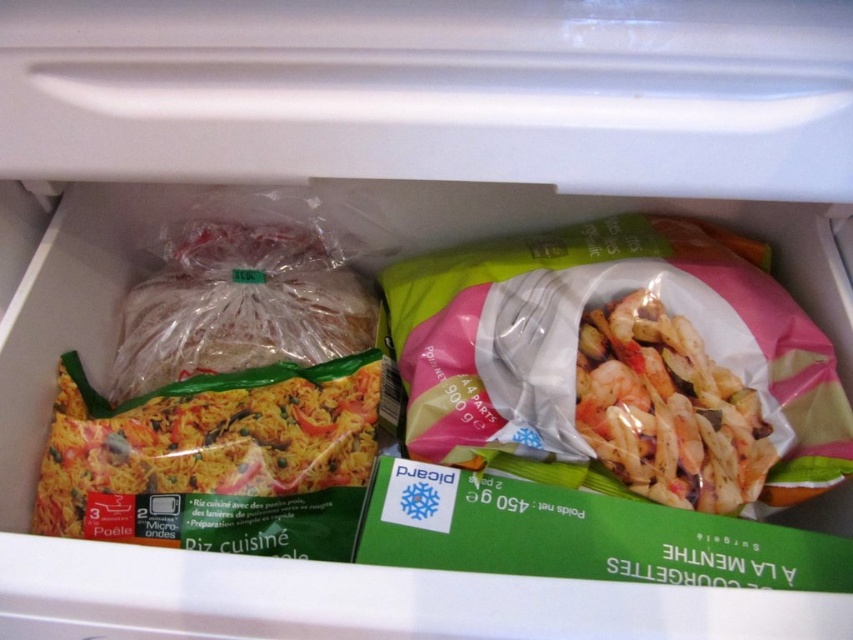
Is green matte rice at center smaller than pink matte shrimp at center?

No, green matte rice at center is not smaller than pink matte shrimp at center.

Between green matte rice at center and pink matte shrimp at center, which one is positioned higher?

pink matte shrimp at center is above.

What are the coordinates of `green matte rice at center` in the screenshot? It's located at (204, 442).

Which is above, pink plastic bag of shrimp at center or pink matte shrimp at center?

Positioned higher is pink plastic bag of shrimp at center.

Which is below, pink plastic bag of shrimp at center or pink matte shrimp at center?

Positioned lower is pink matte shrimp at center.

Describe the element at coordinates (622, 362) in the screenshot. I see `pink plastic bag of shrimp at center` at that location.

Identify the location of pink plastic bag of shrimp at center. [x=622, y=362].

Which is in front, point (479, 256) or point (136, 332)?

Point (479, 256) is more forward.

Between pink plastic bag of shrimp at center and translucent plastic bag of rice at center, which one appears on the right side from the viewer's perspective?

pink plastic bag of shrimp at center

Based on the photo, measure the distance between point (601, 298) and camera.

Point (601, 298) and camera are 24.12 inches apart.

This screenshot has width=853, height=640. I want to click on pink plastic bag of shrimp at center, so click(x=622, y=362).